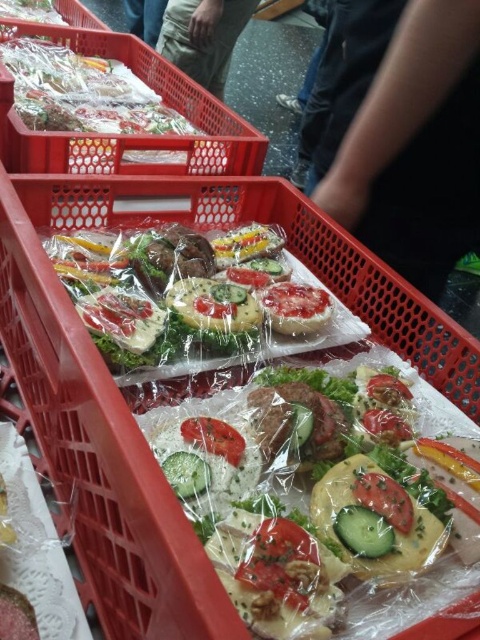
Can you confirm if translucent plastic salad at center is taller than clear plastic sandwiches at upper left?

No.

Between point (264, 454) and point (235, 145), which one is positioned in front?

Point (264, 454) is in front.

Which is in front, point (227, 538) or point (17, 163)?

Point (227, 538) is in front.

In order to click on translucent plastic salad at center in this screenshot , I will do `click(324, 497)`.

Who is higher up, translucent plastic sandwiches at center or clear plastic sandwiches at upper left?

Positioned higher is clear plastic sandwiches at upper left.

Does translucent plastic sandwiches at center appear under clear plastic sandwiches at upper left?

Yes, translucent plastic sandwiches at center is below clear plastic sandwiches at upper left.

Is point (205, 272) closer to viewer compared to point (203, 147)?

Yes, point (205, 272) is in front of point (203, 147).

This screenshot has width=480, height=640. What are the coordinates of `translucent plastic sandwiches at center` in the screenshot? It's located at (177, 291).

Can you confirm if clear plastic sandwiches at center is positioned to the right of translucent plastic sandwiches at center?

Correct, you'll find clear plastic sandwiches at center to the right of translucent plastic sandwiches at center.

Where is `clear plastic sandwiches at center`? The image size is (480, 640). clear plastic sandwiches at center is located at coordinates (122, 396).

What do you see at coordinates (122, 396) in the screenshot?
I see `clear plastic sandwiches at center` at bounding box center [122, 396].

You are a GUI agent. You are given a task and a screenshot of the screen. Output one action in this format:
    pyautogui.click(x=<x>, y=<y>)
    Task: Click on the clear plastic sandwiches at center
    This screenshot has width=480, height=640.
    Given the screenshot: What is the action you would take?
    pyautogui.click(x=122, y=396)